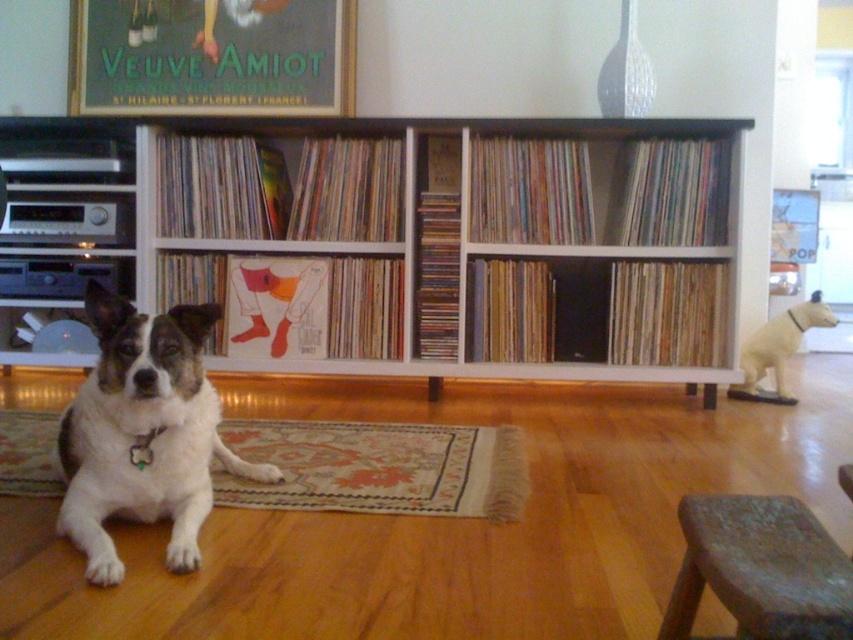
You are a photographer setting up a shoot in this room. You need to place a small tripod between the white fur dog at center and the white matte dog at right. Based on their sizes, which dog should the tripod be closer to?

The white fur dog at center is bigger than the white matte dog at right, so the tripod should be placed closer to the smaller white matte dog at right to maintain balance between the two subjects.

You are standing in the room and want to place a new book on the white wood bookcase at center. According to the coordinates provided, where exactly should you place the book?

The white wood bookcase at center is located at coordinates point (x=465, y=237), so you should place the book there.

You are trying to move the white fur dog at center to the side to make space for a new piece of furniture. Based on the scene, can the white wood bookcase at center fit in the space if the dog is moved?

The white wood bookcase at center might be wider than the white fur dog at center, so moving the dog might not provide enough space for the bookcase to fit unless there is additional room available.